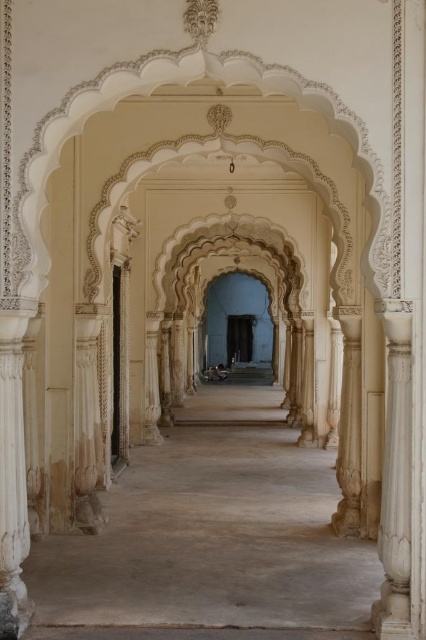
Can you confirm if smooth sandstone corridor at center is wider than white marble column at right?

Indeed, smooth sandstone corridor at center has a greater width compared to white marble column at right.

Can you confirm if smooth sandstone corridor at center is shorter than white marble column at right?

Yes, smooth sandstone corridor at center is shorter than white marble column at right.

Between point (334, 504) and point (400, 304), which one is positioned behind?

Positioned behind is point (334, 504).

Find the location of `smooth sandstone corridor at center`. smooth sandstone corridor at center is located at coordinates (213, 532).